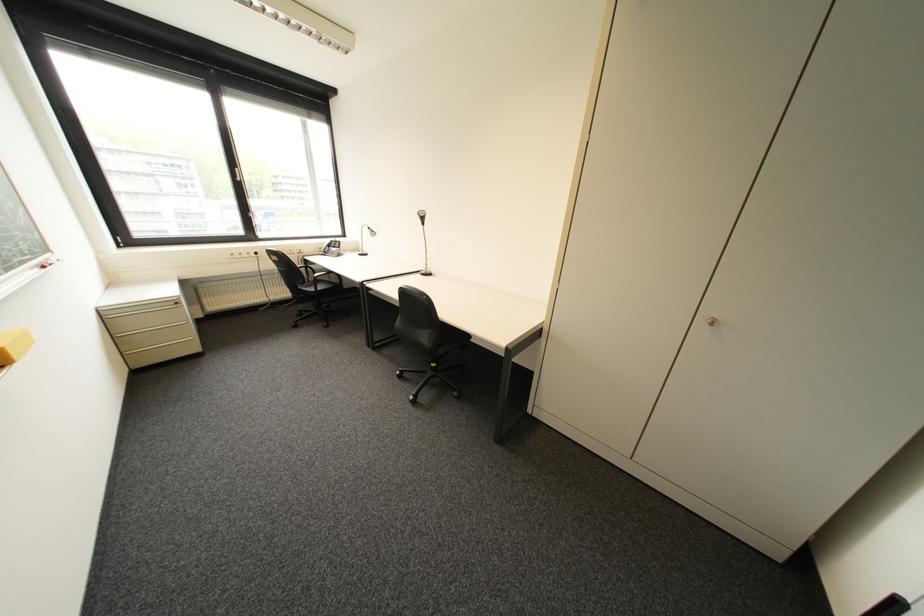
Describe the element at coordinates (711, 321) in the screenshot. I see `the silver cabinet knob` at that location.